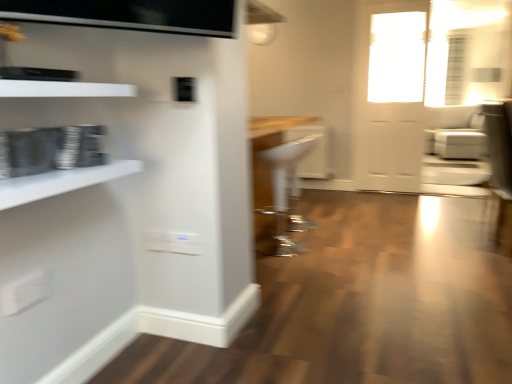
Question: Considering the relative sizes of white leather armchair at right, positioned as the second armchair in front-to-back order, and white glossy shelf at upper left, arranged as the 2th shelf when ordered from the bottom, in the image provided, is white leather armchair at right, positioned as the second armchair in front-to-back order, bigger than white glossy shelf at upper left, arranged as the 2th shelf when ordered from the bottom,?

Choices:
 (A) no
 (B) yes

Answer: (B)

Question: Is white leather armchair at right, the 1th armchair from the right, further to the viewer compared to white glossy shelf at upper left, the 1th shelf from the top?

Choices:
 (A) no
 (B) yes

Answer: (B)

Question: Considering the relative positions of white leather armchair at right, positioned as the second armchair in front-to-back order, and white glossy shelf at upper left, arranged as the 2th shelf when ordered from the bottom, in the image provided, is white leather armchair at right, positioned as the second armchair in front-to-back order, to the right of white glossy shelf at upper left, arranged as the 2th shelf when ordered from the bottom, from the viewer's perspective?

Choices:
 (A) yes
 (B) no

Answer: (A)

Question: From the image's perspective, does white leather armchair at right, positioned as the first armchair in back-to-front order, appear higher than white glossy shelf at upper left, the 1th shelf from the top?

Choices:
 (A) yes
 (B) no

Answer: (A)

Question: Is white leather armchair at right, positioned as the first armchair in back-to-front order, thinner than white glossy shelf at upper left, arranged as the 2th shelf when ordered from the bottom?

Choices:
 (A) no
 (B) yes

Answer: (A)

Question: Is point (460, 155) positioned closer to the camera than point (449, 84)?

Choices:
 (A) closer
 (B) farther

Answer: (A)

Question: From a real-world perspective, is white leather armchair at right, positioned as the second armchair in front-to-back order, above or below clear glass door at upper right?

Choices:
 (A) above
 (B) below

Answer: (B)

Question: From the image's perspective, is white leather armchair at right, which is the 2th armchair from bottom to top, located above or below clear glass door at upper right?

Choices:
 (A) above
 (B) below

Answer: (B)

Question: Considering the positions of white leather armchair at right, positioned as the first armchair in back-to-front order, and clear glass door at upper right in the image, is white leather armchair at right, positioned as the first armchair in back-to-front order, bigger or smaller than clear glass door at upper right?

Choices:
 (A) big
 (B) small

Answer: (A)

Question: From the image's perspective, relative to white glossy shelf at upper left, arranged as the 2th shelf when ordered from the bottom, is white glossy shelf at left, placed as the 2th shelf when sorted from top to bottom, above or below?

Choices:
 (A) below
 (B) above

Answer: (A)

Question: Is white glossy shelf at left, placed as the 2th shelf when sorted from top to bottom, situated inside white glossy shelf at upper left, the 1th shelf from the top, or outside?

Choices:
 (A) outside
 (B) inside

Answer: (A)

Question: In terms of width, does white glossy shelf at left, placed as the 2th shelf when sorted from top to bottom, look wider or thinner when compared to white glossy shelf at upper left, the 1th shelf from the top?

Choices:
 (A) thin
 (B) wide

Answer: (B)

Question: In terms of height, does white glossy shelf at left, which is the 1th shelf in bottom-to-top order, look taller or shorter compared to white glossy shelf at upper left, arranged as the 2th shelf when ordered from the bottom?

Choices:
 (A) short
 (B) tall

Answer: (B)

Question: Considering the positions of white glossy shelf at left, placed as the 2th shelf when sorted from top to bottom, and white glossy door at upper right in the image, is white glossy shelf at left, placed as the 2th shelf when sorted from top to bottom, wider or thinner than white glossy door at upper right?

Choices:
 (A) wide
 (B) thin

Answer: (A)

Question: Considering the positions of white glossy shelf at left, placed as the 2th shelf when sorted from top to bottom, and white glossy door at upper right in the image, is white glossy shelf at left, placed as the 2th shelf when sorted from top to bottom, bigger or smaller than white glossy door at upper right?

Choices:
 (A) small
 (B) big

Answer: (A)